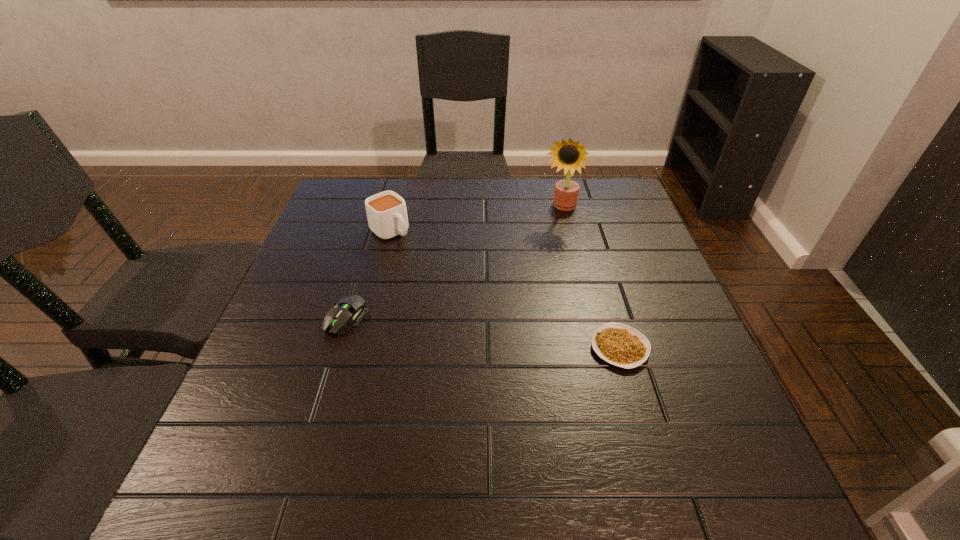
Where is `free region at the left edge of the desktop`? The width and height of the screenshot is (960, 540). free region at the left edge of the desktop is located at coordinates (323, 282).

Find the location of `free space at the right edge`. free space at the right edge is located at coordinates (663, 360).

Locate an element on the screen. The width and height of the screenshot is (960, 540). free spot at the far left corner of the desktop is located at coordinates (363, 191).

At what (x,y) coordinates should I click in order to perform the action: click on vacant space at the near left corner of the desktop. Please return your answer as a coordinate pair (x, y). The width and height of the screenshot is (960, 540). Looking at the image, I should click on (247, 424).

I want to click on vacant space at the far right corner of the desktop, so click(x=620, y=211).

At what (x,y) coordinates should I click in order to perform the action: click on free space between the tallest object and the legume. Please return your answer as a coordinate pair (x, y). Image resolution: width=960 pixels, height=540 pixels. Looking at the image, I should click on (589, 278).

Where is `unoccupied area between the second shortest object and the third shortest object`? The height and width of the screenshot is (540, 960). unoccupied area between the second shortest object and the third shortest object is located at coordinates (369, 275).

Locate an element on the screen. blank region between the tallest object and the legume is located at coordinates (589, 278).

Where is `free spot between the second tallest object and the shortest object`? The image size is (960, 540). free spot between the second tallest object and the shortest object is located at coordinates (505, 290).

Locate an element on the screen. free space between the sunflower and the third tallest object is located at coordinates (453, 264).